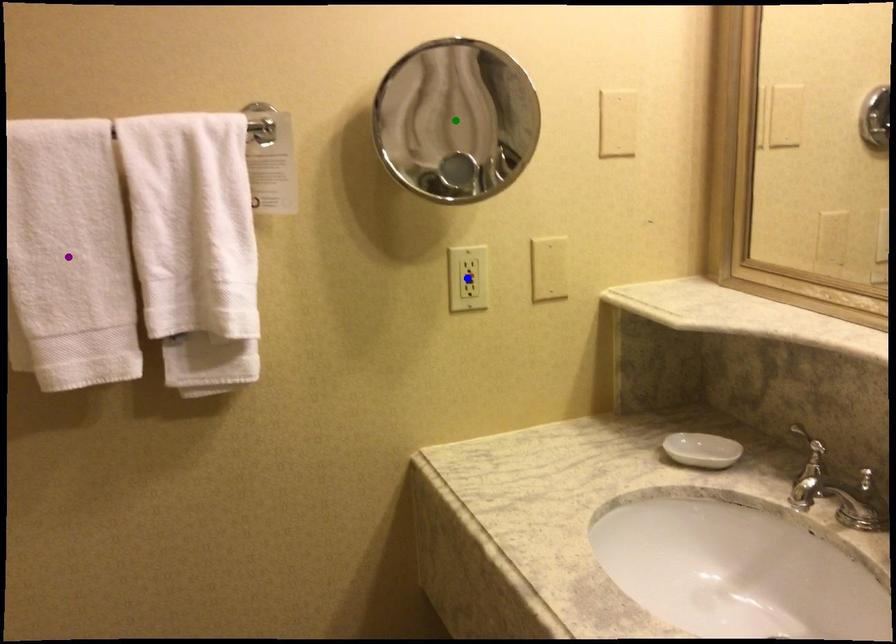
Order these from nearest to farthest:
A) purple point
B) blue point
C) green point

blue point < green point < purple point